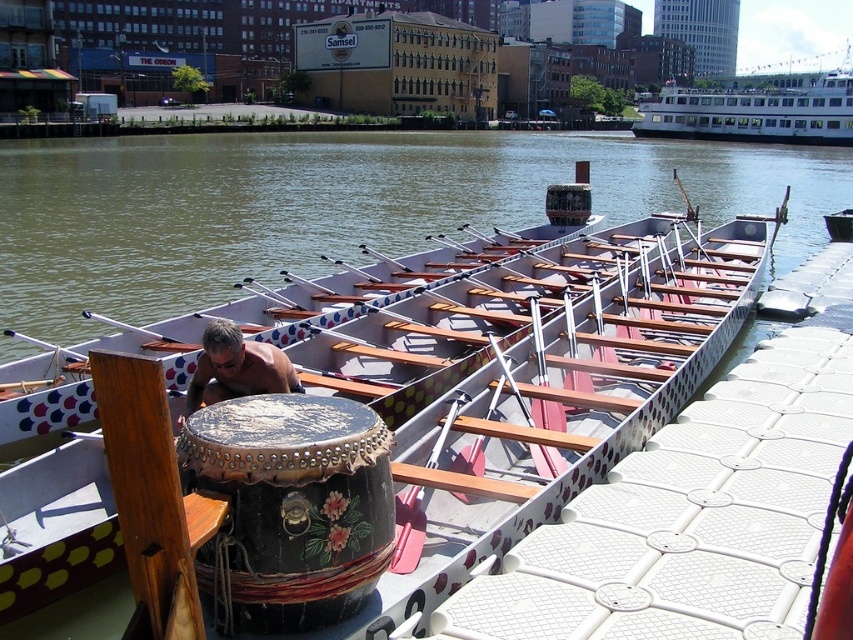
Question: Which is nearer to the brown wooden boat at center?

Choices:
 (A) white glossy ferry at upper right
 (B) smooth brown skin at center

Answer: (B)

Question: Is brown wooden boat at center closer to the viewer compared to white glossy ferry at upper right?

Choices:
 (A) no
 (B) yes

Answer: (B)

Question: Among these objects, which one is nearest to the camera?

Choices:
 (A) brown wooden boat at center
 (B) white glossy ferry at upper right

Answer: (A)

Question: Is black painted wood drum at center to the left of smooth brown skin at center from the viewer's perspective?

Choices:
 (A) no
 (B) yes

Answer: (A)

Question: Considering the relative positions of brown wooden boat at center and black painted wood drum at center in the image provided, where is brown wooden boat at center located with respect to black painted wood drum at center?

Choices:
 (A) above
 (B) below

Answer: (A)

Question: Which of these objects is positioned closest to the brown wooden boat at center?

Choices:
 (A) white glossy ferry at upper right
 (B) smooth brown skin at center

Answer: (B)